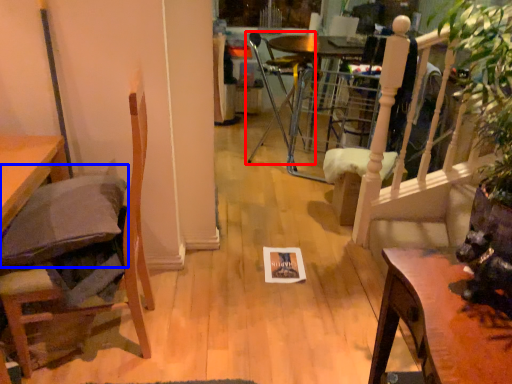
Question: Which object is closer to the camera taking this photo, chair (highlighted by a red box) or pillow (highlighted by a blue box)?

Choices:
 (A) chair
 (B) pillow

Answer: (B)